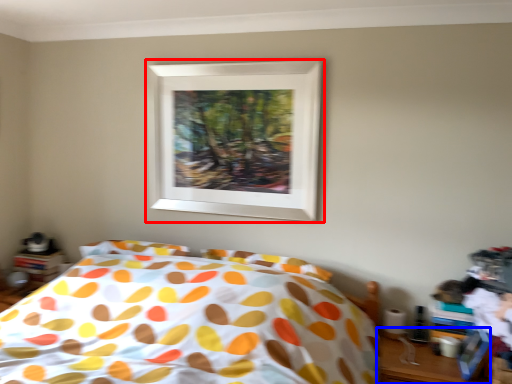
Question: Which of the following is the farthest to the observer, picture frame (highlighted by a red box) or table (highlighted by a blue box)?

Choices:
 (A) picture frame
 (B) table

Answer: (A)